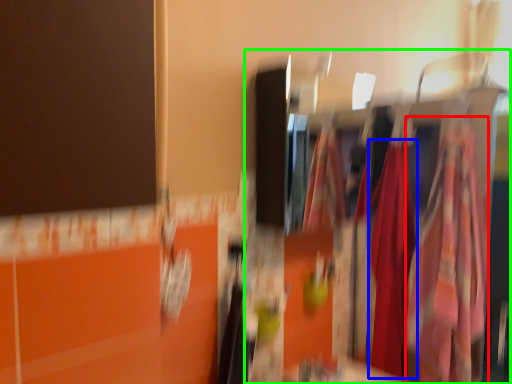
Question: Considering the real-world distances, which object is farthest from clothing (highlighted by a red box)? clothing (highlighted by a blue box) or closet (highlighted by a green box)?

Choices:
 (A) clothing
 (B) closet

Answer: (A)